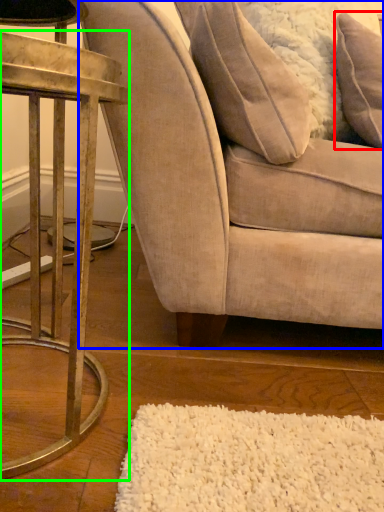
Question: Which object is positioned closest to pillow (highlighted by a red box)? Select from chair (highlighted by a blue box) and table (highlighted by a green box).

Choices:
 (A) chair
 (B) table

Answer: (A)